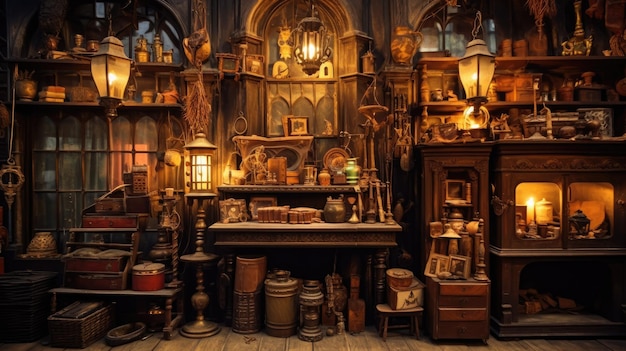
The image size is (626, 351). Identify the location of shelves. (541, 140), (538, 105), (538, 64), (151, 102), (145, 52), (308, 188), (120, 234).